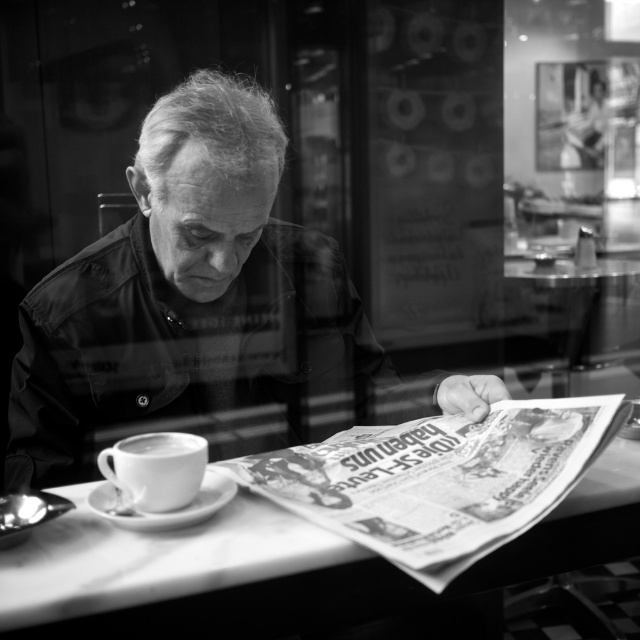
Question: Which point is closer to the camera?

Choices:
 (A) (221, 476)
 (B) (29, 595)
 (C) (115, 484)

Answer: (B)

Question: Can you confirm if smooth leather jacket at center is positioned above white ceramic saucer at lower left?

Choices:
 (A) no
 (B) yes

Answer: (B)

Question: Which object is the closest to the white glossy cup at lower left?

Choices:
 (A) smooth leather jacket at center
 (B) white marble table at center

Answer: (B)

Question: Does smooth leather jacket at center appear on the right side of white marble table at center?

Choices:
 (A) yes
 (B) no

Answer: (B)

Question: Based on their relative distances, which object is nearer to the white marble table at center?

Choices:
 (A) white glossy cup at lower left
 (B) white ceramic saucer at lower left
 (C) smooth leather jacket at center
 (D) white ceramic cup at lower left

Answer: (B)

Question: Is smooth leather jacket at center to the left of white marble table at center from the viewer's perspective?

Choices:
 (A) yes
 (B) no

Answer: (A)